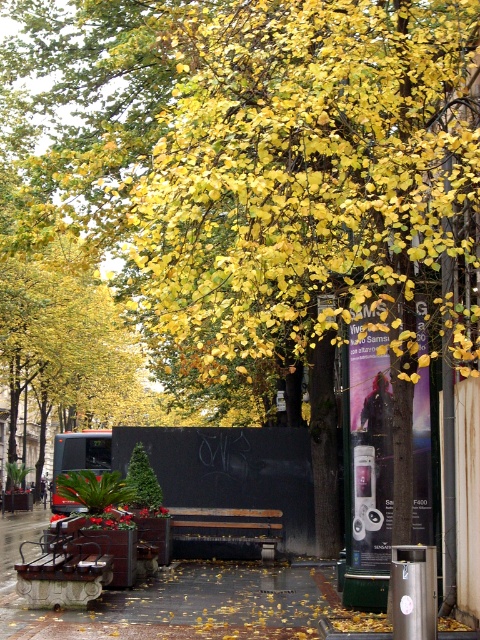
You are a tourist visiting the park and want to sit on the closest bench. Which bench should you choose between the rustic wood bench at lower left and the rusty metal bench at center?

The rustic wood bench at lower left is closer to the viewer than the rusty metal bench at center, so you should choose the rustic wood bench at lower left.

In the scene shown: You are planning to set up a small picnic for two people. Given the space available, which bench between the rustic wood bench at lower left and the rusty metal bench at center would be more suitable for placing a picnic basket and some snacks?

The rusty metal bench at center occupies more space than the rustic wood bench at lower left, making it more suitable for placing a picnic basket and snacks.

You are standing at the center of the walkway and want to sit on the rustic wood bench at lower left. Which direction should you move to reach it?

The rustic wood bench at lower left is located at point (63,566), so you should move to the left and slightly forward to reach it.